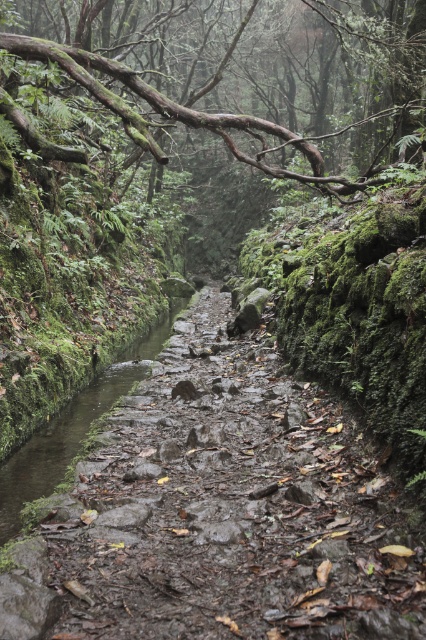
Is brown rough branch at upper center below muddy stone stream at center?

No.

Between brown rough branch at upper center and muddy stone stream at center, which one is positioned higher?

brown rough branch at upper center

Find the location of a particular element. brown rough branch at upper center is located at coordinates (250, 72).